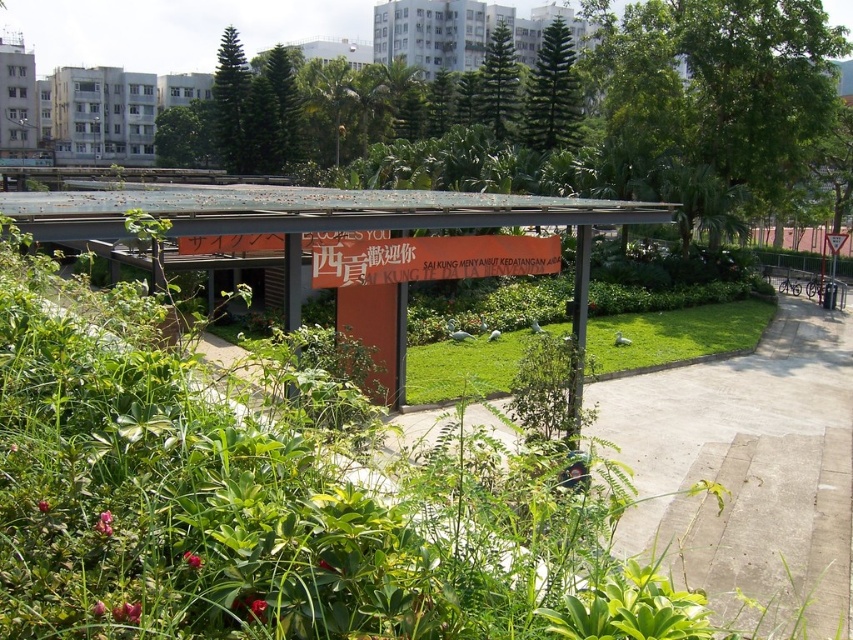
Question: Does metallic orange signboard at center have a larger size compared to green grass at center?

Choices:
 (A) yes
 (B) no

Answer: (A)

Question: Does metallic orange signboard at center have a greater width compared to green grass at center?

Choices:
 (A) no
 (B) yes

Answer: (B)

Question: Among these objects, which one is farthest from the camera?

Choices:
 (A) metallic orange signboard at center
 (B) green grass at center

Answer: (B)

Question: Which object appears farthest from the camera in this image?

Choices:
 (A) metallic orange signboard at center
 (B) green grass at center

Answer: (B)

Question: Does metallic orange signboard at center have a lesser width compared to green grass at center?

Choices:
 (A) yes
 (B) no

Answer: (B)

Question: Which point is farther to the camera?

Choices:
 (A) (463, 387)
 (B) (194, 209)

Answer: (A)